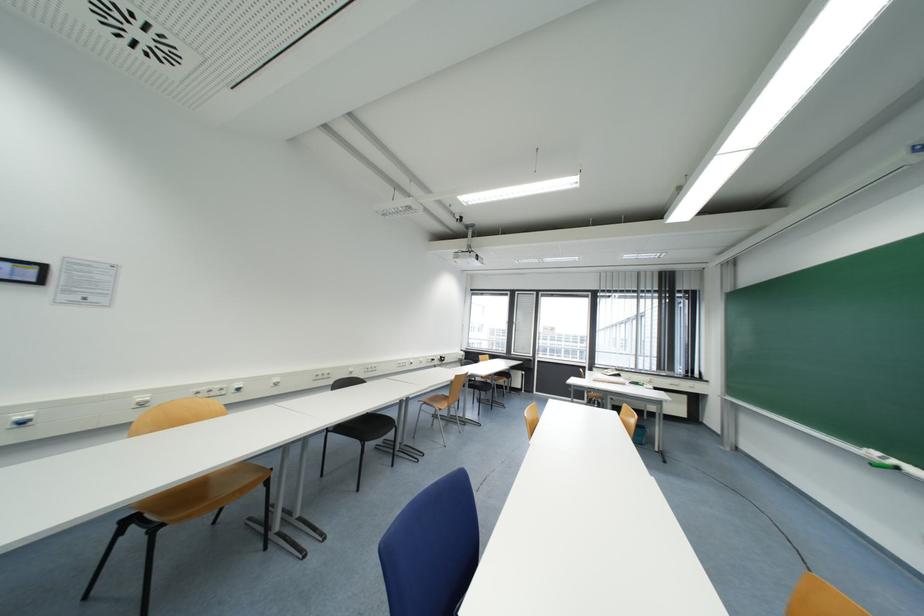
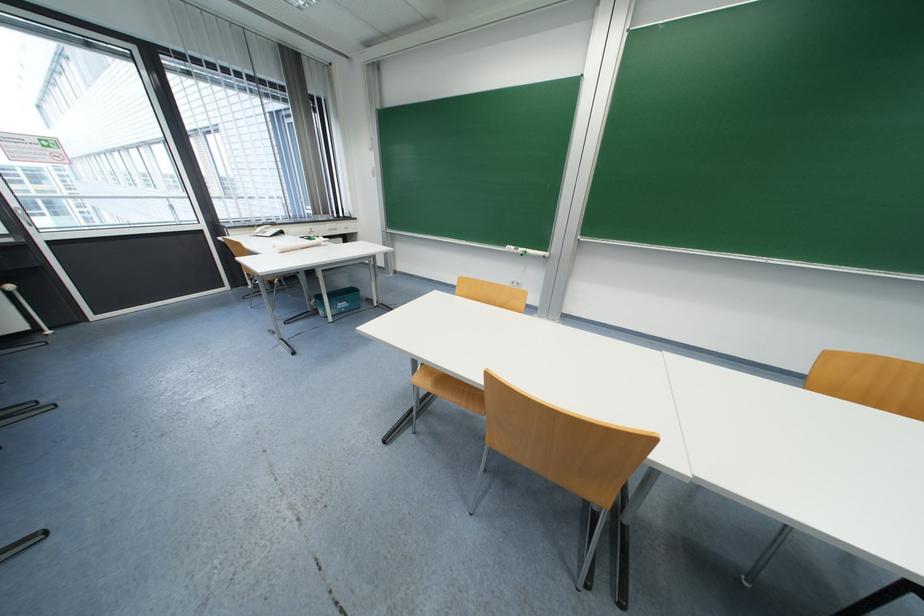
The point at (x=626, y=371) is marked in the first image. Where is the corresponding point in the second image?

(277, 225)